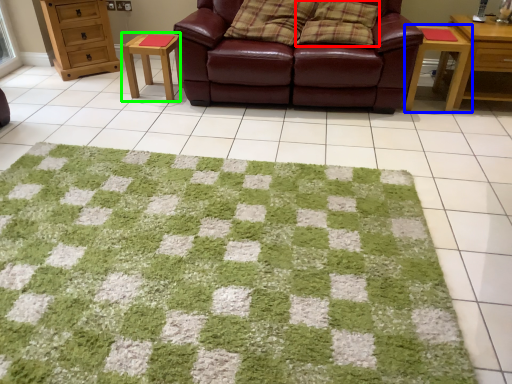
Question: Considering the real-world distances, which object is farthest from pillow (highlighted by a red box)? table (highlighted by a blue box) or table (highlighted by a green box)?

Choices:
 (A) table
 (B) table

Answer: (B)